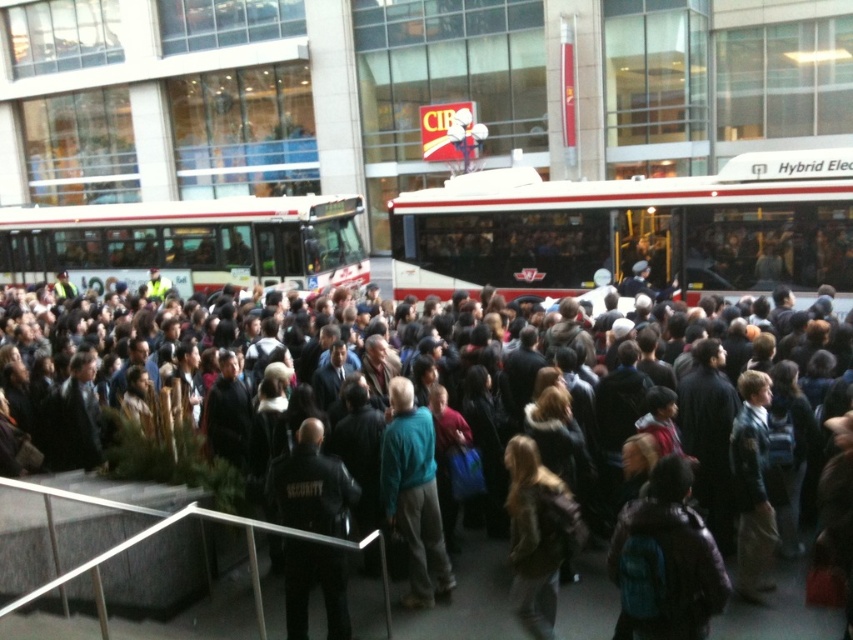
Does dark brown leather jacket at center appear on the left side of white hybrid bus at center?

No, dark brown leather jacket at center is not to the left of white hybrid bus at center.

Is dark brown leather jacket at center wider than white hybrid bus at center?

No, dark brown leather jacket at center is not wider than white hybrid bus at center.

Identify the location of dark brown leather jacket at center. (125, 520).

Identify the location of dark brown leather jacket at center. (125, 520).

Image resolution: width=853 pixels, height=640 pixels. What do you see at coordinates (311, 484) in the screenshot? I see `black leather jacket at center` at bounding box center [311, 484].

Can you confirm if black leather jacket at center is positioned to the left of teal fabric jacket at center?

Yes, black leather jacket at center is to the left of teal fabric jacket at center.

The width and height of the screenshot is (853, 640). In order to click on black leather jacket at center in this screenshot , I will do `click(311, 484)`.

Identify the location of black leather jacket at center. The height and width of the screenshot is (640, 853). (311, 484).

From the picture: Which of these two, teal fabric jacket at center or brown leather jacket at center, stands shorter?

With less height is brown leather jacket at center.

Is teal fabric jacket at center closer to camera compared to brown leather jacket at center?

No.

Is point (447, 600) closer to camera compared to point (535, 513)?

That is False.

What are the coordinates of `teal fabric jacket at center` in the screenshot? It's located at (415, 496).